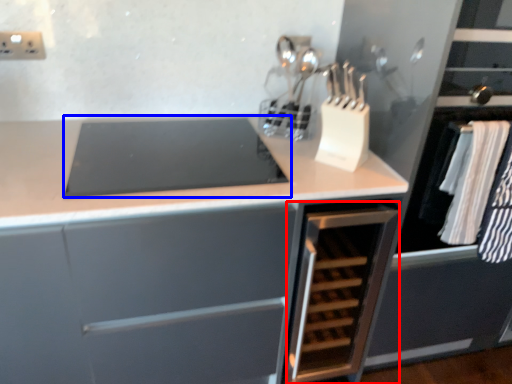
Question: Which object appears closest to the camera in this image, cabinetry (highlighted by a red box) or home appliance (highlighted by a blue box)?

Choices:
 (A) cabinetry
 (B) home appliance

Answer: (B)